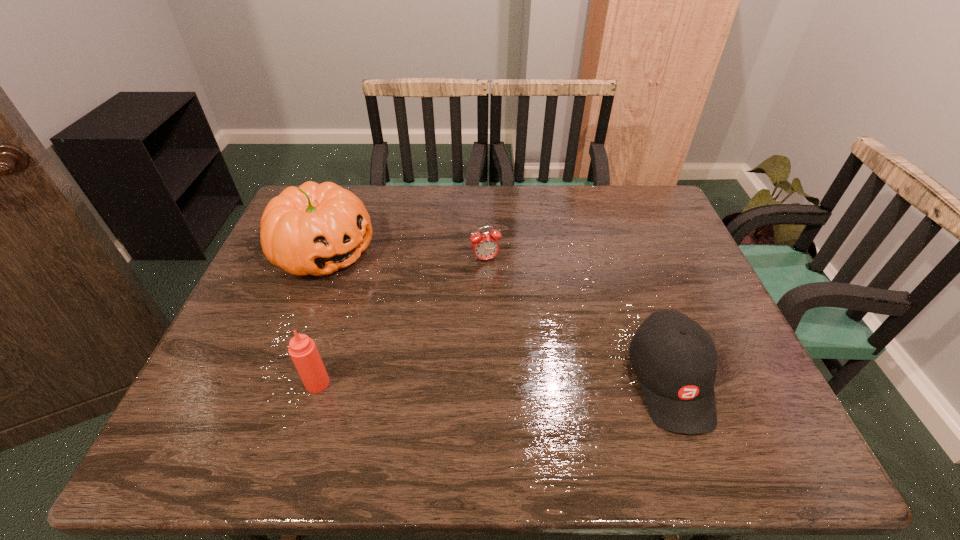
Where is `free point between the second tallest object and the baseball cap`? This screenshot has width=960, height=540. free point between the second tallest object and the baseball cap is located at coordinates (493, 382).

Locate an element on the screen. This screenshot has height=540, width=960. free space between the Tabasco sauce and the pumpkin is located at coordinates (321, 318).

Find the location of a particular element. The height and width of the screenshot is (540, 960). free space between the alarm clock and the Tabasco sauce is located at coordinates (401, 321).

You are a GUI agent. You are given a task and a screenshot of the screen. Output one action in this format:
    pyautogui.click(x=<x>, y=<y>)
    Task: Click on the object that stands as the second closest to the Tabasco sauce
    
    Given the screenshot: What is the action you would take?
    pyautogui.click(x=485, y=246)

Identify which object is the nearest to the pumpkin. Please provide its 2D coordinates. Your answer should be formatted as a tuple, i.e. [(x, y)], where the tuple contains the x and y coordinates of a point satisfying the conditions above.

[(302, 349)]

The image size is (960, 540). What are the coordinates of `free space that satisfies the following two spatial constraints: 1. on the front side of the pumpkin; 2. on the right side of the second tallest object` in the screenshot? It's located at pos(274,383).